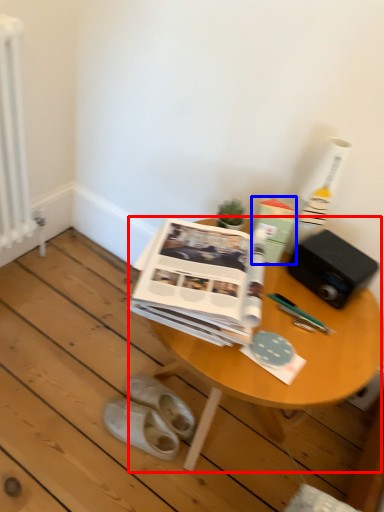
Question: Which object appears closest to the camera in this image, table (highlighted by a red box) or paperback book (highlighted by a blue box)?

Choices:
 (A) table
 (B) paperback book

Answer: (A)